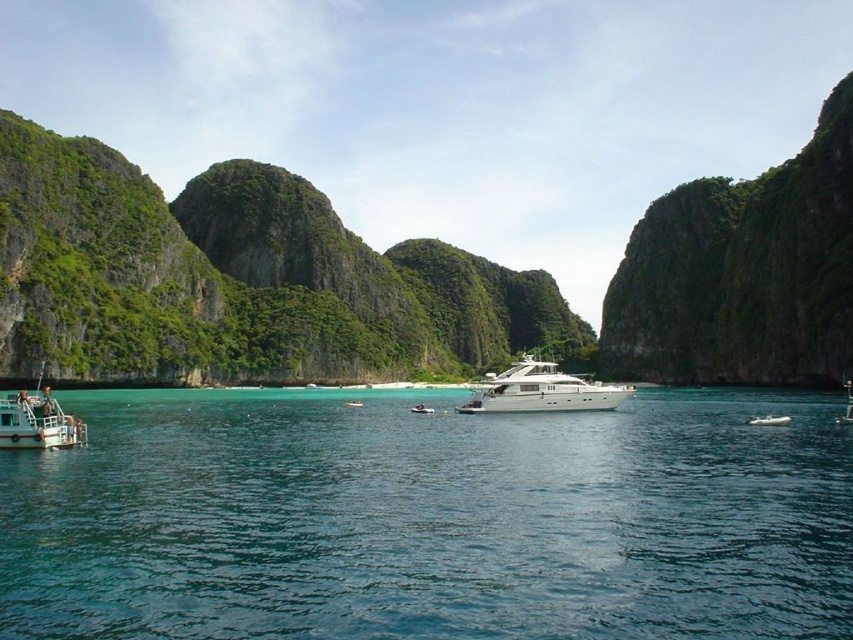
Question: Does white glossy motorboat at center appear on the right side of white glossy boat at center?

Choices:
 (A) no
 (B) yes

Answer: (B)

Question: Is clear blue water at center smaller than white glossy boat at lower left?

Choices:
 (A) no
 (B) yes

Answer: (A)

Question: Which of the following is the closest to the observer?

Choices:
 (A) white glossy motorboat at center
 (B) white glossy boat at center
 (C) clear blue water at center

Answer: (C)

Question: Is white glossy yacht at center smaller than white glossy motorboat at center?

Choices:
 (A) no
 (B) yes

Answer: (A)

Question: Which of the following is the closest to the observer?

Choices:
 (A) clear blue water at center
 (B) white glossy motorboat at center

Answer: (A)

Question: Which object is the farthest from the white glossy motorboat at center?

Choices:
 (A) white glossy yacht at center
 (B) white glossy boat at lower left
 (C) white glossy boat at center

Answer: (B)